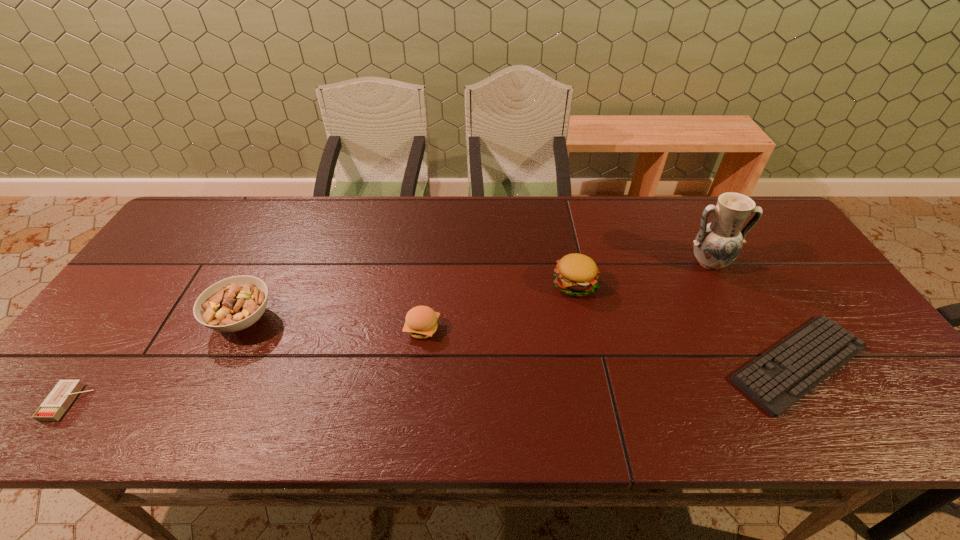
Find the location of a particular element. vacant space located on the right of the taller hamburger is located at coordinates (622, 284).

This screenshot has width=960, height=540. I want to click on free spot located on the back of the stew, so click(282, 238).

Find the location of a particular element. This screenshot has height=540, width=960. free space located on the back of the left hamburger is located at coordinates (430, 260).

Find the location of a particular element. This screenshot has width=960, height=540. blank space located on the striking surface of the leftmost object is located at coordinates (173, 402).

Image resolution: width=960 pixels, height=540 pixels. I want to click on free space located 0.060m on the back of the shortest object, so click(x=761, y=301).

Find the location of a particular element. This screenshot has height=540, width=960. matchbox that is at the near edge is located at coordinates (59, 399).

What are the coordinates of `computer keyboard present at the near edge` in the screenshot? It's located at (777, 379).

Locate an element on the screen. The width and height of the screenshot is (960, 540). object at the left edge is located at coordinates (59, 399).

Identify the location of object situated at the right edge. (777, 379).

You are a GUI agent. You are given a task and a screenshot of the screen. Output one action in this format:
    pyautogui.click(x=<x>, y=<y>)
    Task: Click on the object at the near left corner
    The image size is (960, 540).
    Given the screenshot: What is the action you would take?
    pyautogui.click(x=59, y=399)